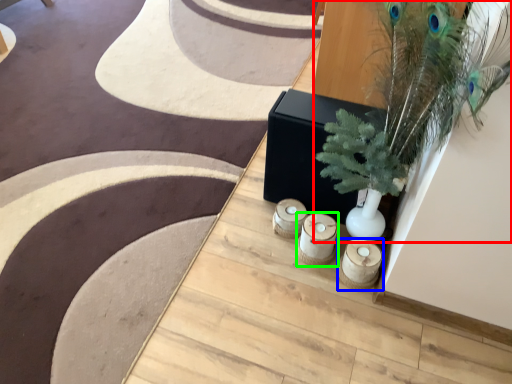
Question: Considering the real-world distances, which object is closest to houseplant (highlighted by a red box)? candle holder (highlighted by a blue box) or candle holder (highlighted by a green box).

Choices:
 (A) candle holder
 (B) candle holder

Answer: (B)